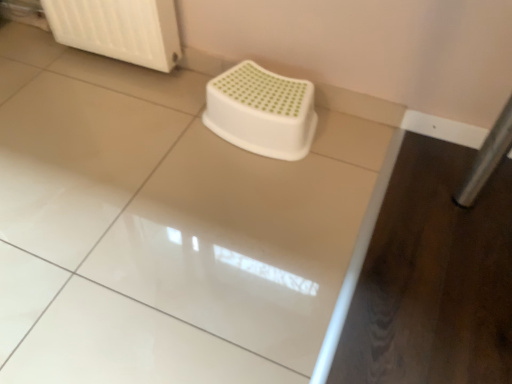
Question: Can you confirm if white glossy counter top at center is positioned to the left of white plastic radiator at upper left?

Choices:
 (A) no
 (B) yes

Answer: (A)

Question: Could you tell me if white glossy counter top at center is turned towards white plastic radiator at upper left?

Choices:
 (A) yes
 (B) no

Answer: (B)

Question: Is white glossy counter top at center bigger than white plastic radiator at upper left?

Choices:
 (A) yes
 (B) no

Answer: (A)

Question: Considering the relative sizes of white glossy counter top at center and white plastic radiator at upper left in the image provided, is white glossy counter top at center shorter than white plastic radiator at upper left?

Choices:
 (A) yes
 (B) no

Answer: (A)

Question: From the image's perspective, would you say white glossy counter top at center is positioned over white plastic radiator at upper left?

Choices:
 (A) no
 (B) yes

Answer: (A)

Question: Does white glossy counter top at center have a greater width compared to white plastic radiator at upper left?

Choices:
 (A) no
 (B) yes

Answer: (B)

Question: Does white plastic radiator at upper left come in front of white plastic stool at center?

Choices:
 (A) yes
 (B) no

Answer: (B)

Question: Is white plastic radiator at upper left positioned beyond the bounds of white plastic stool at center?

Choices:
 (A) yes
 (B) no

Answer: (A)

Question: Is white plastic radiator at upper left next to white plastic stool at center and touching it?

Choices:
 (A) yes
 (B) no

Answer: (B)

Question: Does white plastic radiator at upper left have a greater width compared to white plastic stool at center?

Choices:
 (A) yes
 (B) no

Answer: (B)

Question: Considering the relative positions of white plastic radiator at upper left and white plastic stool at center in the image provided, is white plastic radiator at upper left to the right of white plastic stool at center from the viewer's perspective?

Choices:
 (A) yes
 (B) no

Answer: (B)

Question: From a real-world perspective, is white plastic radiator at upper left located beneath white plastic stool at center?

Choices:
 (A) no
 (B) yes

Answer: (A)

Question: Is white plastic stool at center closer to camera compared to white glossy counter top at center?

Choices:
 (A) no
 (B) yes

Answer: (A)